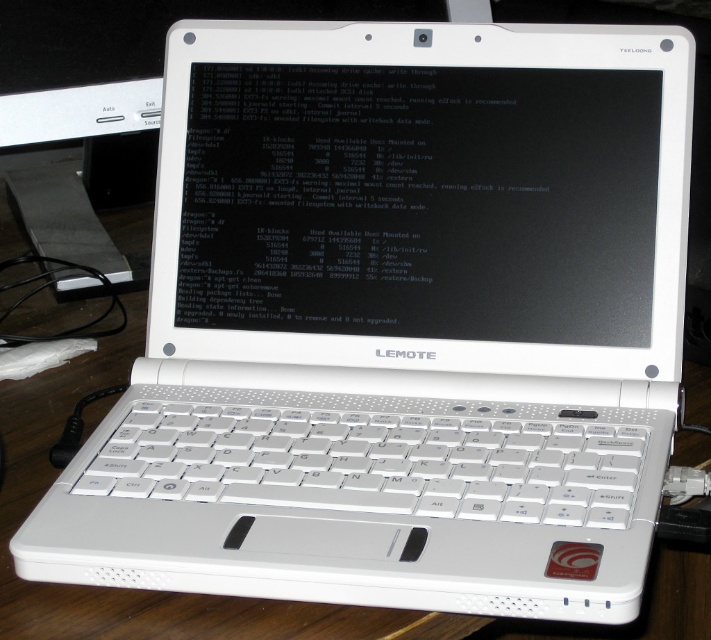
You are a technician examining the Lemote laptop. You notice a point at coordinates (373, 461). What object is located at this point?

The point at coordinates (373, 461) corresponds to the white plastic keyboard at center.